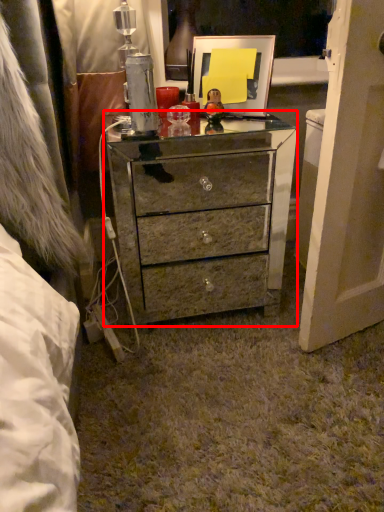
Question: Observing the image, what is the correct spatial positioning of chest of drawers (annotated by the red box) in reference to picture frame?

Choices:
 (A) left
 (B) right

Answer: (A)